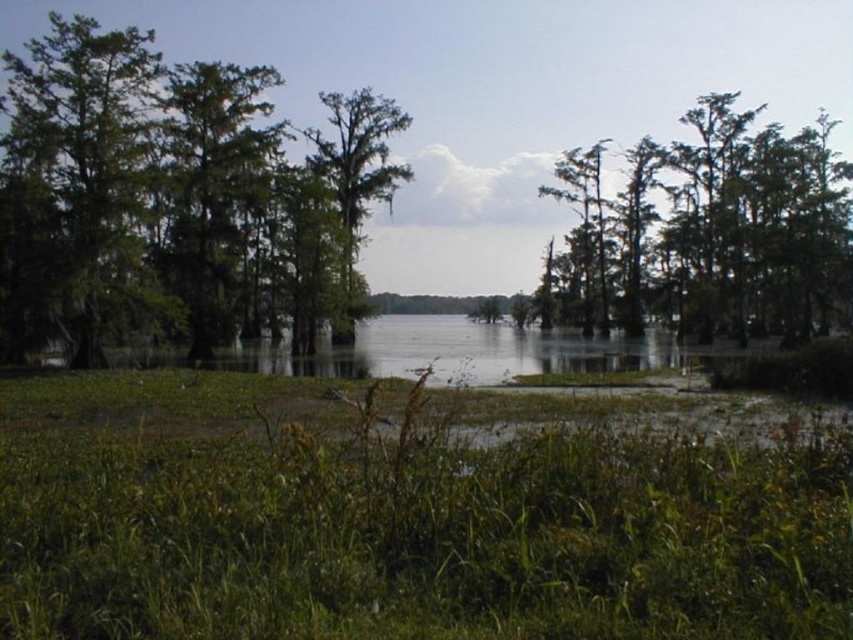
In the scene shown: Can you confirm if green grassy at lower center is positioned above green mossy tree at center?

Actually, green grassy at lower center is below green mossy tree at center.

How much distance is there between green grassy at lower center and green mossy tree at center?

They are 140.47 feet apart.

Measure the distance between green grassy at lower center and camera.

A distance of 12.47 feet exists between green grassy at lower center and camera.

Where is `green grassy at lower center`? This screenshot has width=853, height=640. green grassy at lower center is located at coordinates (412, 513).

Is green mossy trees at left thinner than green mossy tree at center?

Incorrect, green mossy trees at left's width is not less than green mossy tree at center's.

Is green mossy trees at left closer to the viewer compared to green mossy tree at center?

That is True.

Does point (271, 285) lie behind point (383, 186)?

No, it is not.

At what (x,y) coordinates should I click in order to perform the action: click on green mossy trees at left. Please return your answer as a coordinate pair (x, y). This screenshot has width=853, height=640. Looking at the image, I should click on (173, 198).

Does green grassy at lower center have a lesser width compared to green mossy tree at left?

Indeed, green grassy at lower center has a lesser width compared to green mossy tree at left.

Who is higher up, green grassy at lower center or green mossy tree at left?

green mossy tree at left is higher up.

I want to click on green grassy at lower center, so click(x=412, y=513).